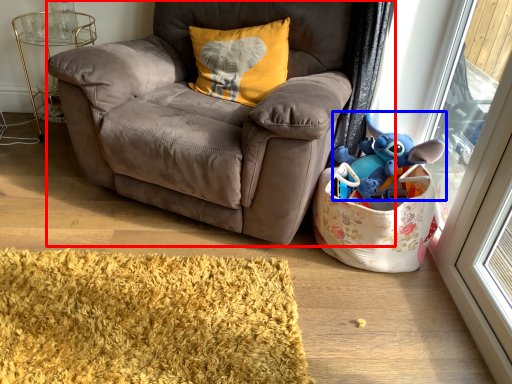
Question: Which point is further to the camera, chair (highlighted by a red box) or toy (highlighted by a blue box)?

Choices:
 (A) chair
 (B) toy

Answer: (B)